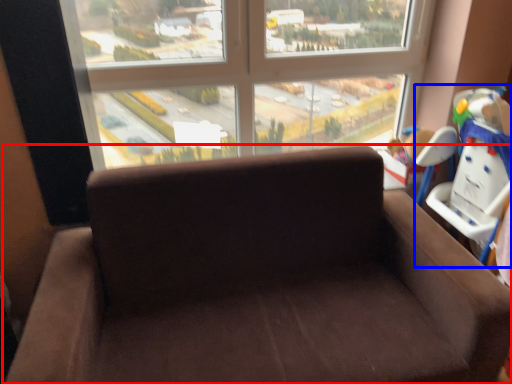
Question: Among these objects, which one is nearest to the camera, studio couch (highlighted by a red box) or baby carriage (highlighted by a blue box)?

Choices:
 (A) studio couch
 (B) baby carriage

Answer: (A)